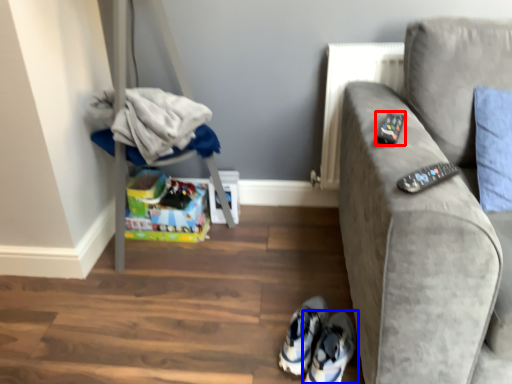
Question: Which point is further to the camera, remote (highlighted by a red box) or footwear (highlighted by a blue box)?

Choices:
 (A) remote
 (B) footwear

Answer: (B)